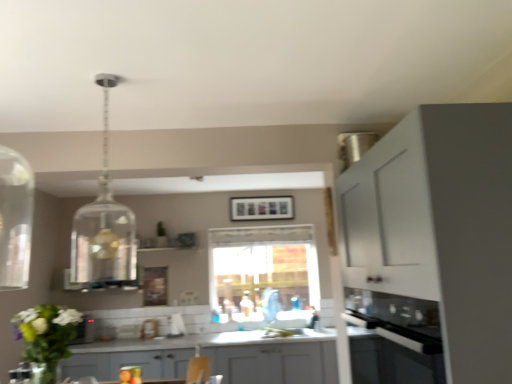
Question: From a real-world perspective, is black glass oven at lower right positioned above or below white matte cabinet at right, arranged as the second cabinetry when viewed from the back?

Choices:
 (A) below
 (B) above

Answer: (A)

Question: Is black glass oven at lower right in front of or behind white matte cabinet at right, arranged as the second cabinetry when viewed from the back, in the image?

Choices:
 (A) front
 (B) behind

Answer: (B)

Question: Which object is positioned closest to the gray matte cabinet at center, which is the second cabinetry in front-to-back order?

Choices:
 (A) transparent glass window at center
 (B) matte black picture frame at center
 (C) white matte cabinet at right, which is counted as the second cabinetry, starting from the bottom
 (D) translucent glass bottle at center
 (E) black glass oven at lower right

Answer: (A)

Question: Estimate the real-world distances between objects in this image. Which object is farther from the transparent glass window at center?

Choices:
 (A) matte black picture frame at center
 (B) black glass oven at lower right
 (C) translucent glass bottle at center
 (D) clear glass pendant light at upper center
 (E) gray matte cabinet at center, which appears as the 1th cabinetry when ordered from the bottom

Answer: (D)